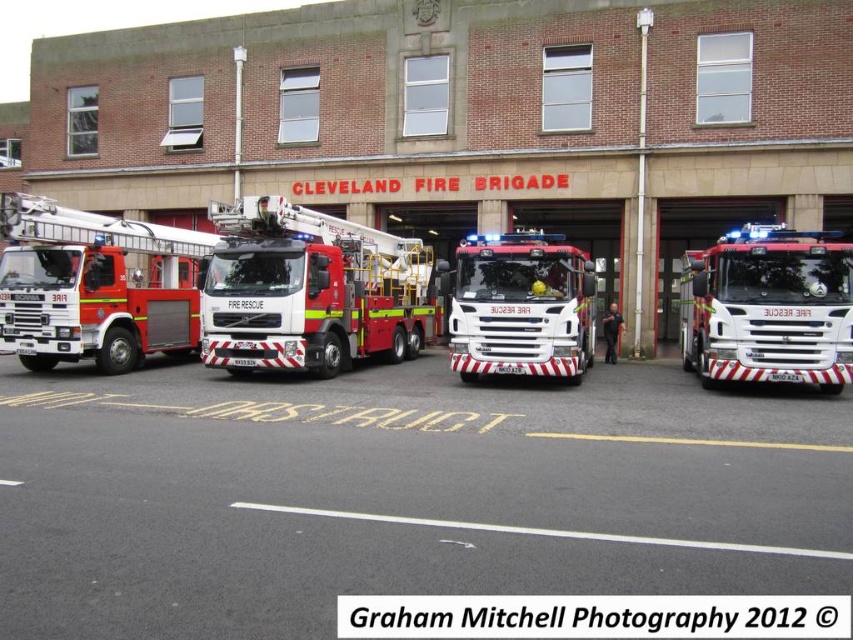
You are a firefighter who needs to choose a fire truck for a rescue mission. The mission requires a larger vehicle to carry more equipment. Which truck should you select between the red matte fire truck at left and the red glossy fire truck at right?

The red glossy fire truck at right is larger than the red matte fire truck at left, so you should select the red glossy fire truck at right for the rescue mission to carry more equipment.

You are a firefighter who needs to quickly identify the closest fire truck to the entrance of the Cleveland Fire Brigade building. Based on the scene, which fire truck is positioned closer to the entrance? The entrance is located where the large sign is displayed. Please choose between the red matte fire truck at left and the red glossy fire truck at center.

The red matte fire truck at left is positioned to the left of the red glossy fire truck at center. Since they are parked in a row in front of the building, the leftmost truck would be closer to the entrance where the sign is located. Therefore, the red matte fire truck at left is closer to the entrance.

You are a delivery driver with a package that needs to be placed between the red matte fire truck at center and the red glossy fire truck at right. The package requires 8 meters of space to be safely placed. Based on the scene, can you safely place the package between them?

The red matte fire truck at center and the red glossy fire truck at right are 8.49 meters apart, which is more than the required 8 meters. Therefore, you can safely place the package between them.